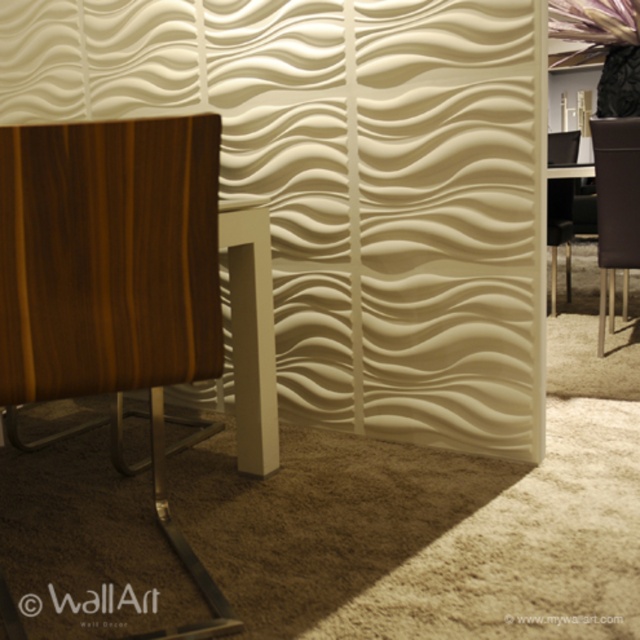
Question: Can you confirm if walnut wood swivel chair at left is positioned to the right of black leather chair at right?

Choices:
 (A) no
 (B) yes

Answer: (A)

Question: Does walnut wood swivel chair at left have a larger size compared to black leather chair at right?

Choices:
 (A) yes
 (B) no

Answer: (B)

Question: Which point is closer to the camera?

Choices:
 (A) black leather chair at right
 (B) walnut wood swivel chair at left
 (C) brown leather chair at right

Answer: (B)

Question: Can you confirm if walnut wood swivel chair at left is positioned below brown leather chair at right?

Choices:
 (A) no
 (B) yes

Answer: (B)

Question: Estimate the real-world distances between objects in this image. Which object is farther from the black leather chair at right?

Choices:
 (A) walnut wood swivel chair at left
 (B) brown leather chair at right

Answer: (A)

Question: Which is farther from the walnut wood swivel chair at left?

Choices:
 (A) black leather chair at right
 (B) brown leather chair at right

Answer: (A)